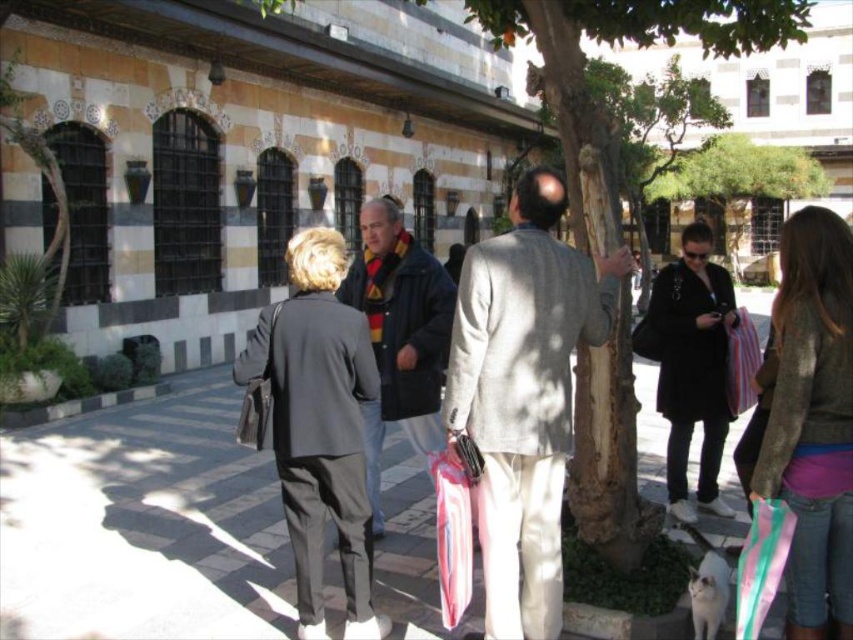
Is point (599, 426) less distant than point (732, 328)?

Yes, point (599, 426) is in front of point (732, 328).

Is point (683, 13) positioned behind point (732, 364)?

That is False.

Is point (585, 532) in front of point (751, 390)?

That is True.

You are a GUI agent. You are given a task and a screenshot of the screen. Output one action in this format:
    pyautogui.click(x=<x>, y=<y>)
    Task: Click on the smooth bark tree at center
    This screenshot has width=853, height=640.
    Given the screenshot: What is the action you would take?
    pyautogui.click(x=621, y=44)

Can you confirm if dark blue jacket at center is positioned above green leafy tree at upper center?

No.

Between point (376, 401) and point (759, 188), which one is positioned in front?

Positioned in front is point (376, 401).

Describe the element at coordinates (399, 333) in the screenshot. This screenshot has width=853, height=640. I see `dark blue jacket at center` at that location.

Locate an element on the screen. The image size is (853, 640). dark blue jacket at center is located at coordinates (399, 333).

Can you confirm if dark gray suit at center is thinner than striped fabric bag at center?

Incorrect, dark gray suit at center's width is not less than striped fabric bag at center's.

Who is more forward, (x=364, y=524) or (x=463, y=572)?

Point (x=463, y=572)

This screenshot has width=853, height=640. Describe the element at coordinates (318, 426) in the screenshot. I see `dark gray suit at center` at that location.

Locate an element on the screen. dark gray suit at center is located at coordinates point(318,426).